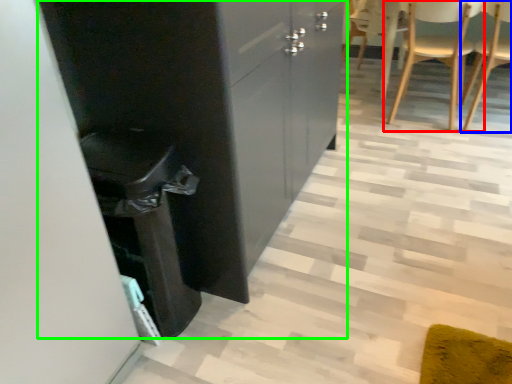
Question: Which object is positioned farthest from chair (highlighted by a red box)? Select from chair (highlighted by a blue box) and cabinetry (highlighted by a green box).

Choices:
 (A) chair
 (B) cabinetry

Answer: (B)